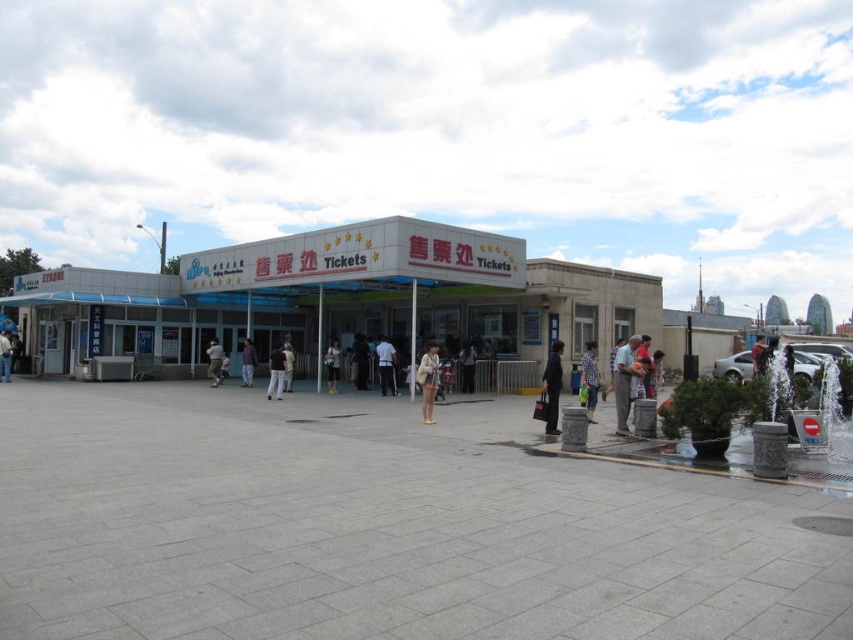
Describe the element at coordinates (276, 372) in the screenshot. This screenshot has width=853, height=640. I see `black cotton pants at center` at that location.

Does black cotton pants at center have a lesser height compared to dark gray fabric jacket at center?

Yes.

What do you see at coordinates (276, 372) in the screenshot? I see `black cotton pants at center` at bounding box center [276, 372].

I want to click on black cotton pants at center, so click(276, 372).

Is blue cotton shirt at center bigger than light blue fabric umbrella at lower left?

Yes, blue cotton shirt at center is bigger than light blue fabric umbrella at lower left.

You are a GUI agent. You are given a task and a screenshot of the screen. Output one action in this format:
    pyautogui.click(x=<x>, y=<y>)
    Task: Click on the blue cotton shirt at center
    The height and width of the screenshot is (640, 853).
    Given the screenshot: What is the action you would take?
    tap(589, 378)

Which is in front, point (589, 394) or point (1, 344)?

Point (589, 394)

Where is `blue cotton shirt at center`? The image size is (853, 640). blue cotton shirt at center is located at coordinates (589, 378).

Is black cotton pants at center bigger than light brown leather jacket at center?

Yes.

Who is taller, black cotton pants at center or light brown leather jacket at center?

Standing taller between the two is black cotton pants at center.

Describe the element at coordinates (276, 372) in the screenshot. I see `black cotton pants at center` at that location.

This screenshot has height=640, width=853. I want to click on black cotton pants at center, so click(x=276, y=372).